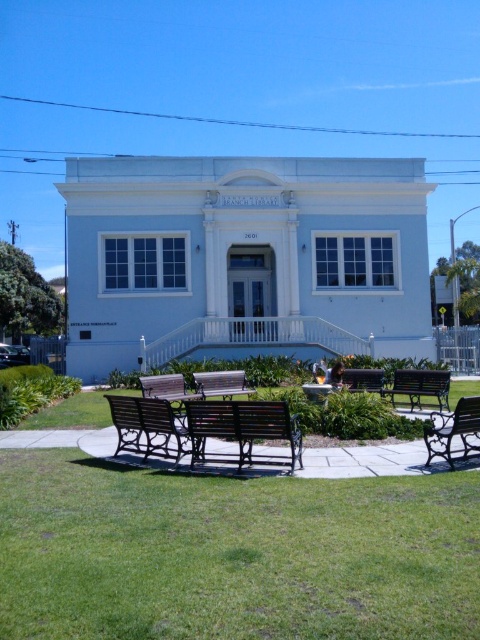
You are standing at the entrance of the BRANCH LIBRARY and want to sit on the black wrought iron bench at lower right. Based on the coordinates provided, in which direction should you walk from the entrance to reach the bench?

The black wrought iron bench at lower right is located at coordinates point (454, 429), so you should walk towards the lower right direction from the entrance to reach it.

You are a visitor standing at the entrance of the BRANCH LIBRARY. You see the black wrought iron bench at lower right and the green wooden bench at lower right. Which bench is closer to the library entrance?

The black wrought iron bench at lower right is closer to the library entrance because it is positioned below the green wooden bench at lower right, meaning it is situated lower in the image and thus nearer to the entrance.

You are standing in front of the BRANCH LIBRARY and want to sit on one of the benches. If you walk straight ahead, which bench will you reach first, the dark brown wooden bench at center or the metallic polished bench at center?

The dark brown wooden bench at center is closer to the viewer than the metallic polished bench at center, so you will reach the dark brown wooden bench at center first.